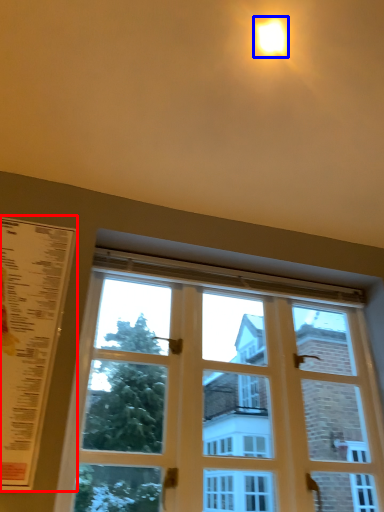
Question: Among these objects, which one is nearest to the camera, menu (highlighted by a red box) or light (highlighted by a blue box)?

Choices:
 (A) menu
 (B) light

Answer: (A)